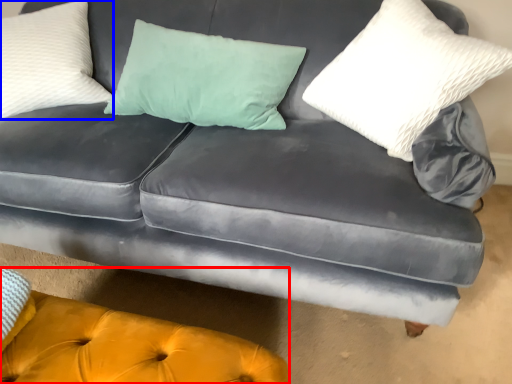
Question: Which object is closer to the camera taking this photo, couch (highlighted by a red box) or pillow (highlighted by a blue box)?

Choices:
 (A) couch
 (B) pillow

Answer: (A)